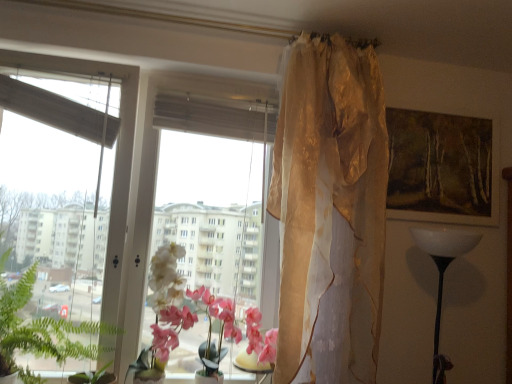
Question: Should I look upward or downward to see wooden framed painting at upper right?

Choices:
 (A) up
 (B) down

Answer: (A)

Question: Is transparent glass window at center smaller than translucent glass table at center?

Choices:
 (A) yes
 (B) no

Answer: (B)

Question: From a real-world perspective, is transparent glass window at center physically above translucent glass table at center?

Choices:
 (A) yes
 (B) no

Answer: (A)

Question: From the image's perspective, does transparent glass window at center appear lower than translucent glass table at center?

Choices:
 (A) no
 (B) yes

Answer: (A)

Question: Is transparent glass window at center not inside translucent glass table at center?

Choices:
 (A) no
 (B) yes

Answer: (B)

Question: Does transparent glass window at center turn towards translucent glass table at center?

Choices:
 (A) yes
 (B) no

Answer: (A)

Question: From the image's perspective, would you say transparent glass window at center is positioned over translucent glass table at center?

Choices:
 (A) yes
 (B) no

Answer: (A)

Question: From a real-world perspective, is translucent glass table at center beneath translucent gold curtain at upper center?

Choices:
 (A) yes
 (B) no

Answer: (A)

Question: Does translucent glass table at center have a larger size compared to translucent gold curtain at upper center?

Choices:
 (A) yes
 (B) no

Answer: (B)

Question: Does translucent glass table at center come behind translucent gold curtain at upper center?

Choices:
 (A) yes
 (B) no

Answer: (A)

Question: Does translucent glass table at center appear on the left side of translucent gold curtain at upper center?

Choices:
 (A) yes
 (B) no

Answer: (A)

Question: Considering the relative sizes of translucent glass table at center and translucent gold curtain at upper center in the image provided, is translucent glass table at center smaller than translucent gold curtain at upper center?

Choices:
 (A) yes
 (B) no

Answer: (A)

Question: Is translucent gold curtain at upper center surrounded by translucent glass table at center?

Choices:
 (A) yes
 (B) no

Answer: (B)

Question: Could you tell me if translucent gold curtain at upper center is turned towards wooden framed painting at upper right?

Choices:
 (A) no
 (B) yes

Answer: (A)